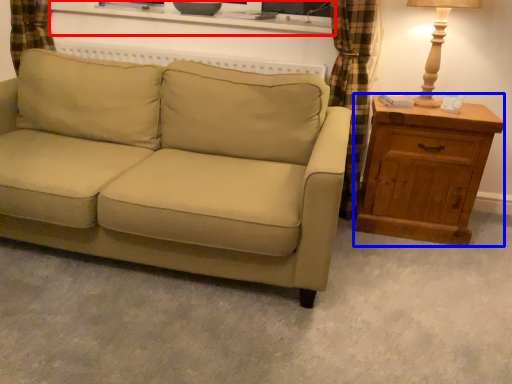
Question: Which object is closer to the camera taking this photo, entertainment center (highlighted by a red box) or chest of drawers (highlighted by a blue box)?

Choices:
 (A) entertainment center
 (B) chest of drawers

Answer: (B)